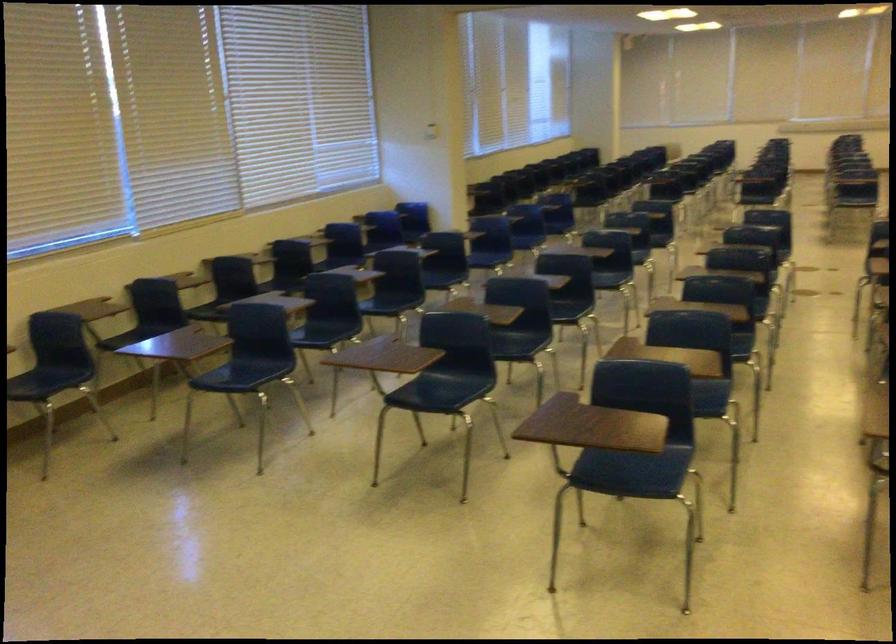
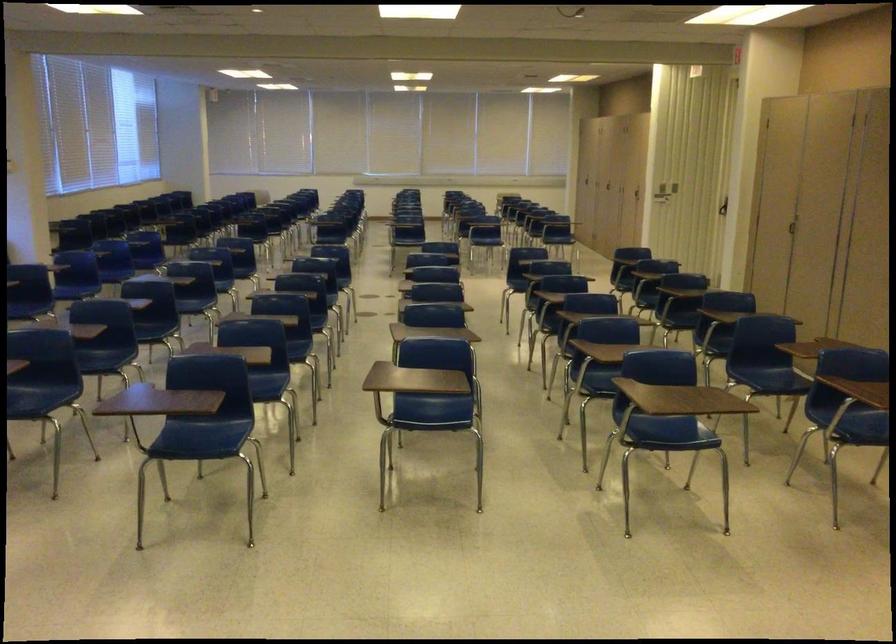
Where in the second image is the point corresponding to [455,386] from the first image?

(39, 395)